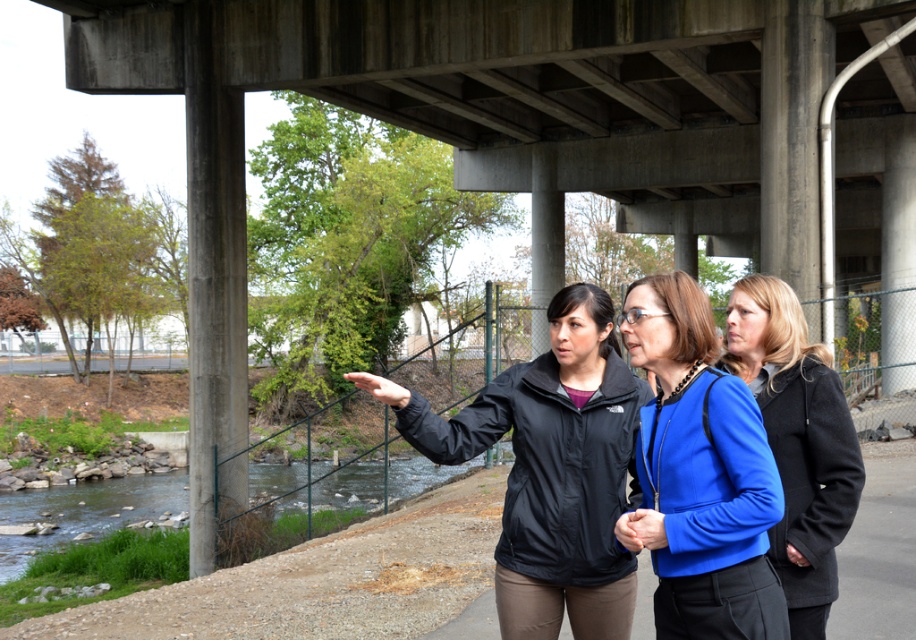
You are a photographer carrying a camera bag that is 30 cm wide. You want to place it between the blue fabric jacket at center and the clear water at lower left. Will the camera bag fit in the space between them?

The blue fabric jacket at center is narrower than the clear water at lower left, so the space between them is sufficient to accommodate the 30 cm wide camera bag.

From the picture: You are a photographer trying to capture a group photo of the three individuals under the overpass. You want to ensure that the blue matte jacket at center and the blue fabric jacket at center are clearly visible. Which jacket will appear narrower in the photo?

The blue matte jacket at center will appear narrower in the photo because it has a lesser width compared to the blue fabric jacket at center.

You are a photographer standing on the paved path near the river. You want to take a photo of the blue fabric jacket at center and the black matte jacket at center. Which jacket will appear smaller in the photo?

The blue fabric jacket at center will appear smaller in the photo because it is behind the black matte jacket at center, so it is farther away from the camera.